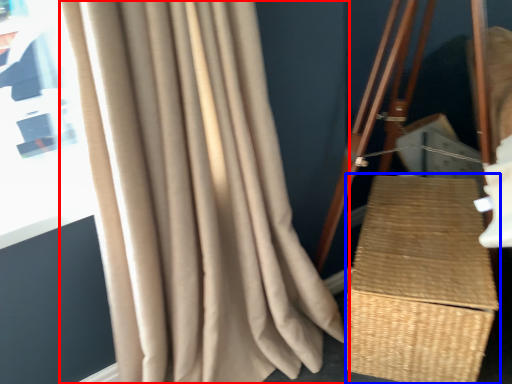
Question: Which object appears farthest to the camera in this image, curtain (highlighted by a red box) or basket (highlighted by a blue box)?

Choices:
 (A) curtain
 (B) basket

Answer: (B)